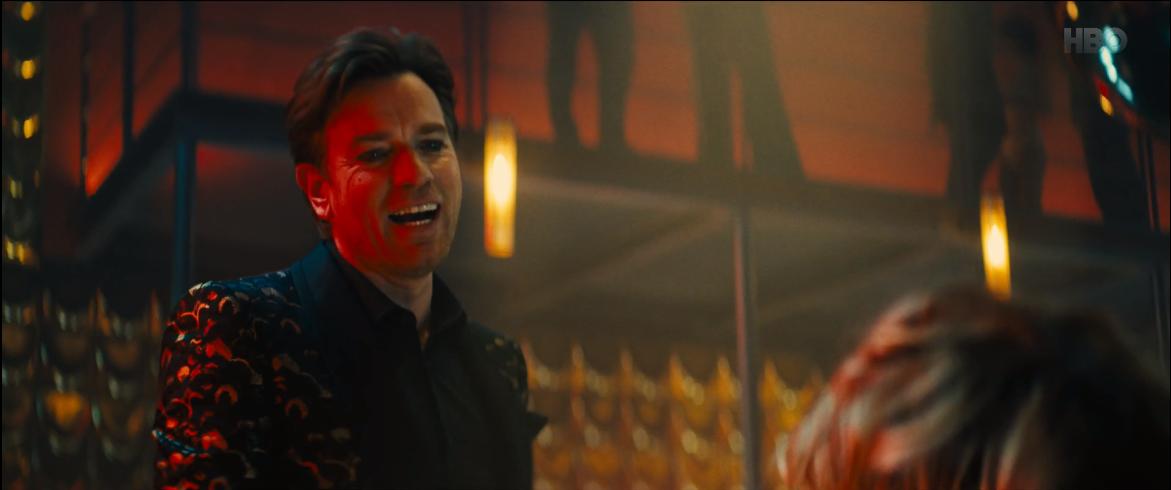
At what (x,y) coordinates should I click in order to perform the action: click on light fixtures. Please return your answer as a coordinate pair (x, y). This screenshot has height=490, width=1171. Looking at the image, I should click on (500, 184), (999, 245).